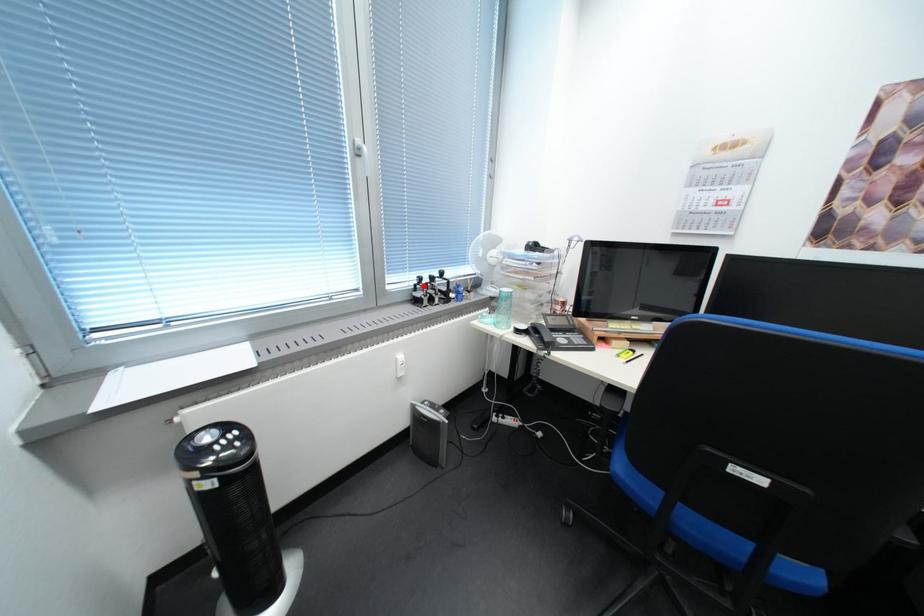
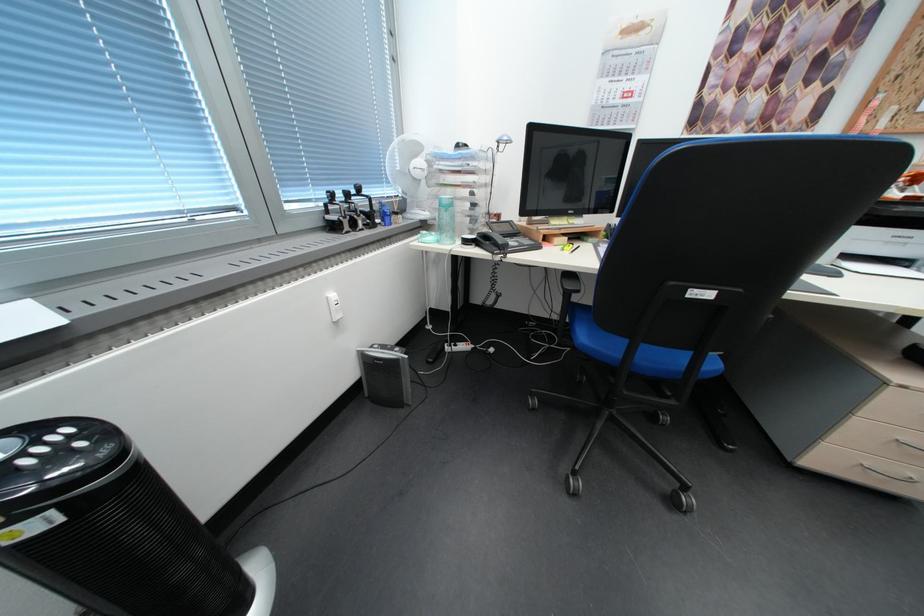
In the second image, find the point that corresponds to the highlighted location in the first image.

(333, 206)